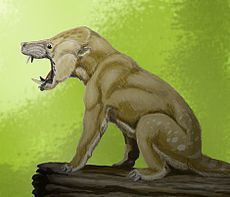
I want to click on floor, so click(113, 175).